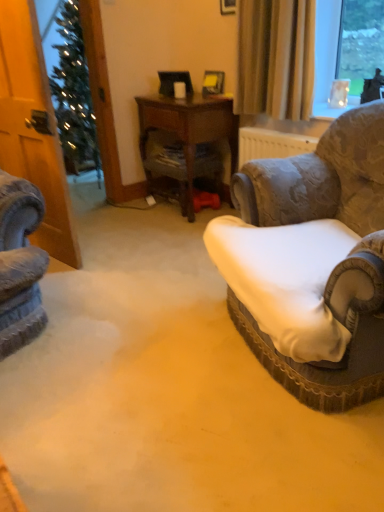
Find the location of a particular element. The height and width of the screenshot is (512, 384). free location to the left of velvet-patterned armchair at right is located at coordinates (136, 345).